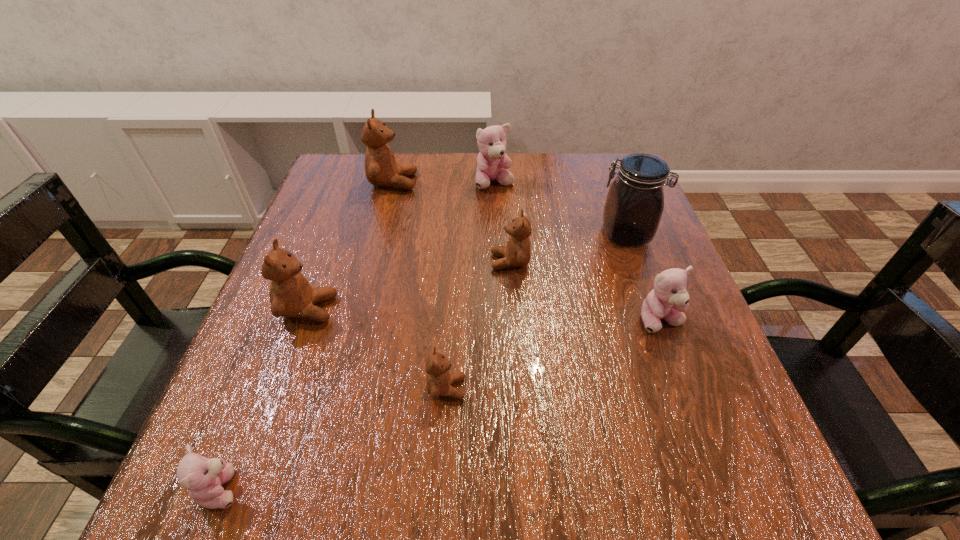
This screenshot has height=540, width=960. I want to click on free spot between the biggest brown teddy bear and the second farthest brown teddy bear, so click(x=451, y=222).

In order to click on vacant space that is in between the second farthest pink teddy bear and the jar in this screenshot , I will do [x=643, y=278].

This screenshot has height=540, width=960. I want to click on free area in between the tallest teddy bear and the rightmost brown teddy bear, so click(451, 222).

The image size is (960, 540). What are the coordinates of `empty space between the third biggest brown teddy bear and the second biggest brown teddy bear` in the screenshot? It's located at (409, 285).

Select which object appears as the seventh closest to the second smallest pink teddy bear. Please provide its 2D coordinates. Your answer should be formatted as a tuple, i.e. [(x, y)], where the tuple contains the x and y coordinates of a point satisfying the conditions above.

[(203, 478)]

Point out which object is positioned as the sixth nearest to the rightmost teddy bear. Please provide its 2D coordinates. Your answer should be formatted as a tuple, i.e. [(x, y)], where the tuple contains the x and y coordinates of a point satisfying the conditions above.

[(381, 169)]

The image size is (960, 540). Find the location of `the closest teddy bear to the farthest brown teddy bear`. the closest teddy bear to the farthest brown teddy bear is located at coordinates (492, 141).

Locate which teddy bear is the fifth closest to the third brown teddy bear from left to right. Please provide its 2D coordinates. Your answer should be formatted as a tuple, i.e. [(x, y)], where the tuple contains the x and y coordinates of a point satisfying the conditions above.

[(381, 169)]

Locate which brown teddy bear ranks fourth in proximity to the jar. Please provide its 2D coordinates. Your answer should be formatted as a tuple, i.e. [(x, y)], where the tuple contains the x and y coordinates of a point satisfying the conditions above.

[(291, 295)]

Where is `the closest brown teddy bear relative to the third smallest brown teddy bear`? The width and height of the screenshot is (960, 540). the closest brown teddy bear relative to the third smallest brown teddy bear is located at coordinates (439, 380).